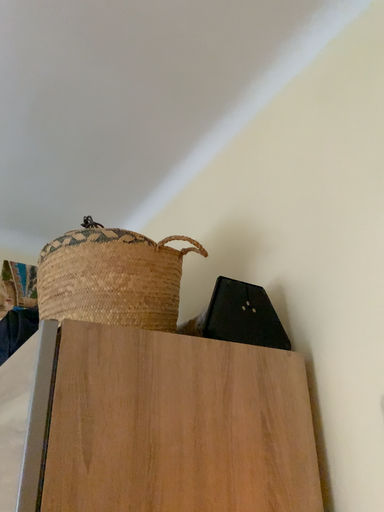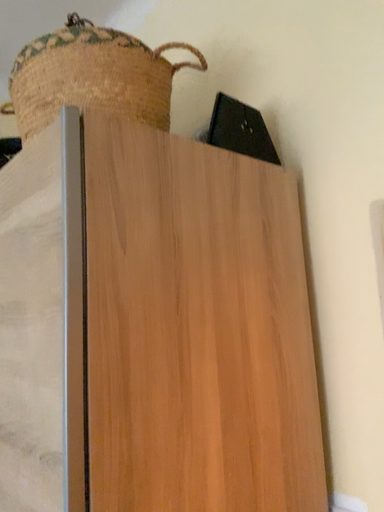
Question: Which way did the camera rotate in the video?

Choices:
 (A) rotated left
 (B) rotated right

Answer: (B)